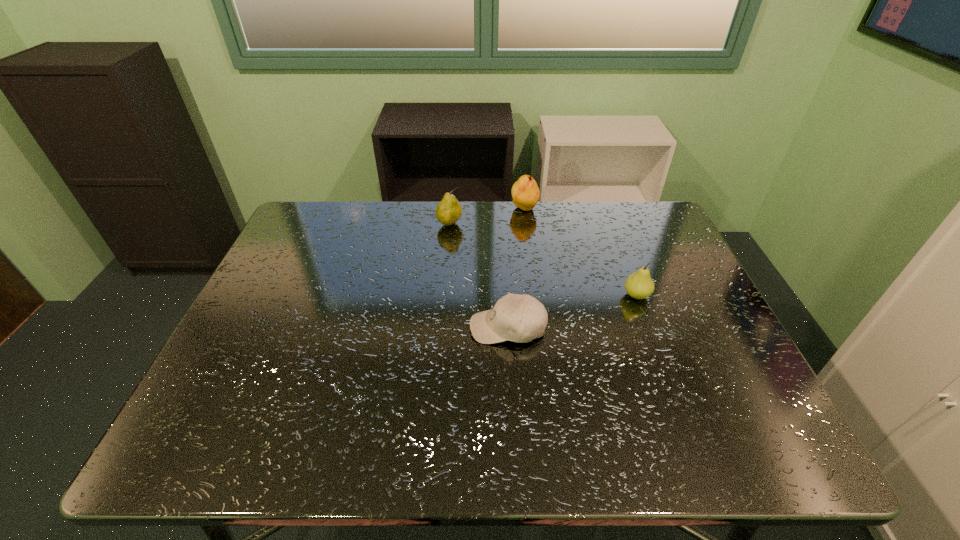
Locate an element on the screen. free space at the far right corner is located at coordinates (643, 241).

In the image, there is a desktop. Where is `vacant space at the near right corner`? The image size is (960, 540). vacant space at the near right corner is located at coordinates (707, 449).

Locate an element on the screen. vacant area that lies between the baseball cap and the leftmost object is located at coordinates (479, 276).

Find the location of a particular element. vacant area between the nearest pear and the baseball cap is located at coordinates (572, 312).

I want to click on empty location between the rightmost object and the farthest pear, so click(581, 252).

Locate an element on the screen. The image size is (960, 540). vacant space in between the shortest object and the rightmost pear is located at coordinates (572, 312).

Where is `unoccupied area between the rightmost pear and the shortest object`? This screenshot has height=540, width=960. unoccupied area between the rightmost pear and the shortest object is located at coordinates (572, 312).

The width and height of the screenshot is (960, 540). What are the coordinates of `blank region between the nearest pear and the baseball cap` in the screenshot? It's located at (572, 312).

At what (x,y) coordinates should I click in order to perform the action: click on blank region between the nearest object and the second pear from right to left. Please return your answer as a coordinate pair (x, y). This screenshot has height=540, width=960. Looking at the image, I should click on (516, 268).

Identify the location of free spot between the second farthest object and the farthest object. (487, 217).